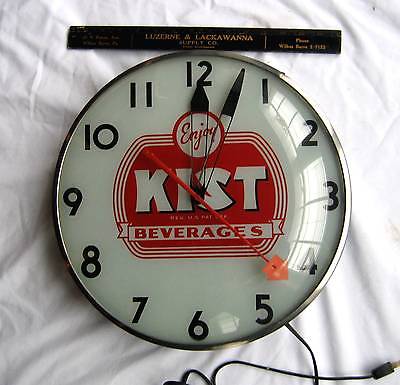
Identify the location of clock. Image resolution: width=400 pixels, height=385 pixels. (192, 263).